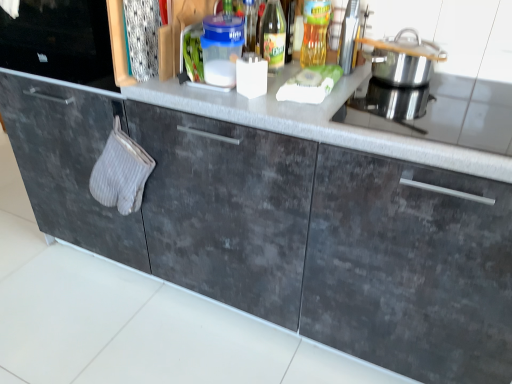
Question: From the image's perspective, would you say translucent glass bottle at upper center, which ranks as the first bottle in left-to-right order, is positioned over metallic silver toaster at upper right?

Choices:
 (A) no
 (B) yes

Answer: (A)

Question: From a real-world perspective, is translucent glass bottle at upper center, which ranks as the first bottle in left-to-right order, on metallic silver toaster at upper right?

Choices:
 (A) yes
 (B) no

Answer: (B)

Question: Does translucent glass bottle at upper center, which ranks as the first bottle in left-to-right order, have a lesser width compared to metallic silver toaster at upper right?

Choices:
 (A) no
 (B) yes

Answer: (A)

Question: Does translucent glass bottle at upper center, the 2th bottle in the right-to-left sequence, touch metallic silver toaster at upper right?

Choices:
 (A) yes
 (B) no

Answer: (B)

Question: Does translucent glass bottle at upper center, which ranks as the first bottle in left-to-right order, have a larger size compared to metallic silver toaster at upper right?

Choices:
 (A) no
 (B) yes

Answer: (A)

Question: Is translucent glass bottle at upper center, the 2th bottle in the right-to-left sequence, located outside metallic silver toaster at upper right?

Choices:
 (A) no
 (B) yes

Answer: (B)

Question: Is metallic silver toaster at upper right smaller than transparent glass bottle at center, acting as the first bottle starting from the right?

Choices:
 (A) yes
 (B) no

Answer: (B)

Question: Considering the relative sizes of metallic silver toaster at upper right and transparent glass bottle at center, acting as the first bottle starting from the right, in the image provided, is metallic silver toaster at upper right bigger than transparent glass bottle at center, acting as the first bottle starting from the right,?

Choices:
 (A) yes
 (B) no

Answer: (A)

Question: Is metallic silver toaster at upper right outside of transparent glass bottle at center, the second bottle viewed from the left?

Choices:
 (A) no
 (B) yes

Answer: (B)

Question: Is there a large distance between metallic silver toaster at upper right and transparent glass bottle at center, acting as the first bottle starting from the right?

Choices:
 (A) yes
 (B) no

Answer: (B)

Question: Can you confirm if metallic silver toaster at upper right is positioned to the right of transparent glass bottle at center, the second bottle viewed from the left?

Choices:
 (A) no
 (B) yes

Answer: (B)

Question: From the image's perspective, does metallic silver toaster at upper right appear lower than transparent glass bottle at center, the second bottle viewed from the left?

Choices:
 (A) no
 (B) yes

Answer: (B)

Question: Is silver metallic pot at upper right positioned with its back to transparent glass bottle at center, acting as the first bottle starting from the right?

Choices:
 (A) yes
 (B) no

Answer: (B)